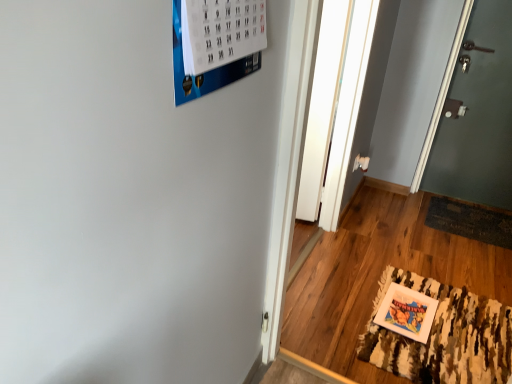
Question: Based on their sizes in the image, would you say white matte picture frame at lower right is bigger or smaller than camouflage-patterned rug at lower right?

Choices:
 (A) small
 (B) big

Answer: (A)

Question: Visually, is white matte picture frame at lower right positioned to the left or to the right of camouflage-patterned rug at lower right?

Choices:
 (A) left
 (B) right

Answer: (A)

Question: Which object is positioned farthest from the green matte door at right?

Choices:
 (A) transparent glass door at center
 (B) camouflage-patterned rug at lower right
 (C) dark brown woven mat at lower right
 (D) white matte picture frame at lower right

Answer: (D)

Question: Considering the real-world distances, which object is closest to the green matte door at right?

Choices:
 (A) camouflage-patterned rug at lower right
 (B) dark brown woven mat at lower right
 (C) white matte picture frame at lower right
 (D) transparent glass door at center

Answer: (B)